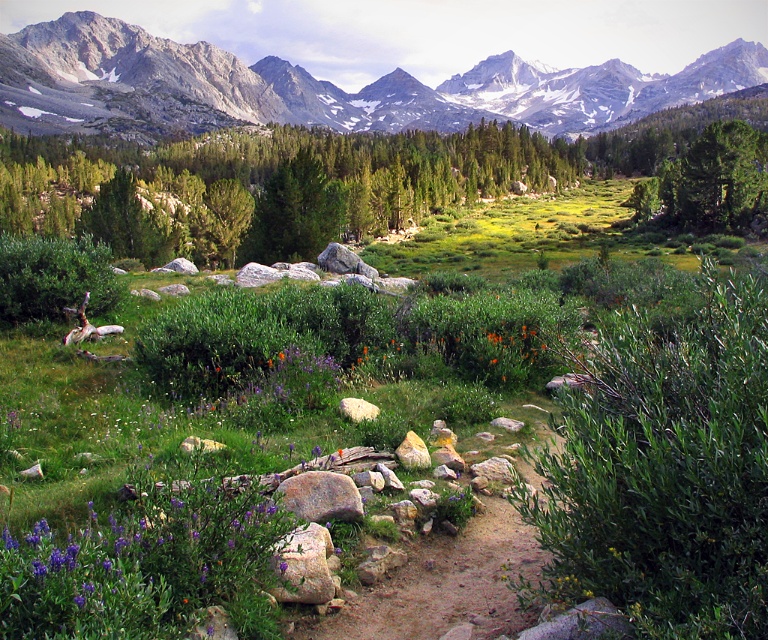
Based on the scene described, what does the point at coordinates (320, 86) represent?

The point at coordinates (320, 86) indicates the gray rocky mountain range at upper center.